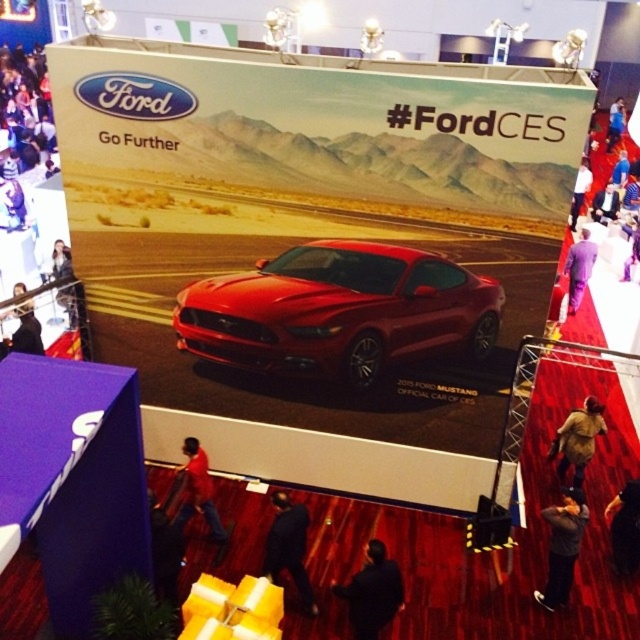
Who is positioned more to the left, dark blue fabric at center or purple fabric at right?

From the viewer's perspective, dark blue fabric at center appears more on the left side.

What do you see at coordinates (372, 593) in the screenshot? I see `dark blue fabric at center` at bounding box center [372, 593].

Identify the location of dark blue fabric at center. The height and width of the screenshot is (640, 640). click(x=372, y=593).

Is red shirt at center wider than black leather jacket at lower right?

Correct, the width of red shirt at center exceeds that of black leather jacket at lower right.

Find the location of `red shirt at center`. red shirt at center is located at coordinates (195, 492).

Does shiny red car at center have a smaller size compared to dark blue fabric at center?

No, shiny red car at center is not smaller than dark blue fabric at center.

Can you confirm if shiny red car at center is positioned to the right of dark blue fabric at center?

In fact, shiny red car at center is to the left of dark blue fabric at center.

Find the location of a particular element. This screenshot has height=640, width=640. shiny red car at center is located at coordinates (339, 310).

At what (x,y) coordinates should I click in order to perform the action: click on shiny red car at center. Please return your answer as a coordinate pair (x, y). This screenshot has height=640, width=640. Looking at the image, I should click on (339, 310).